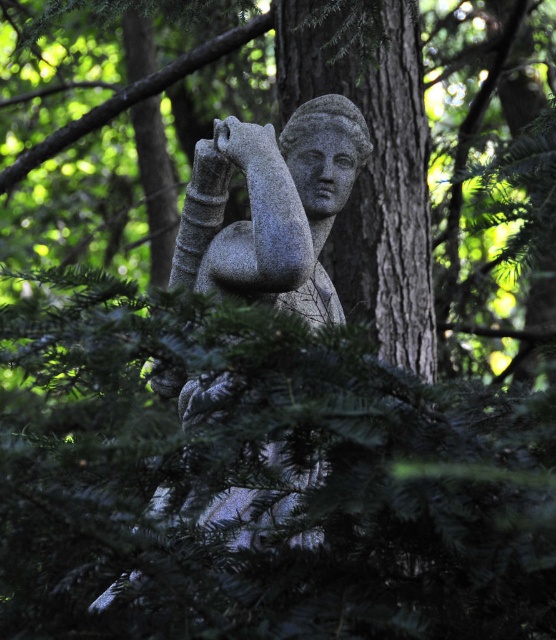
The image size is (556, 640). In order to click on gray stone tree trunk at center in this screenshot , I will do `click(371, 161)`.

Does gray stone tree trunk at center come behind granite statue at center?

Yes, gray stone tree trunk at center is further from the viewer.

Who is more distant from viewer, (379, 141) or (363, 161)?

The point (379, 141) is behind.

Identify the location of gray stone tree trunk at center. Image resolution: width=556 pixels, height=640 pixels. (371, 161).